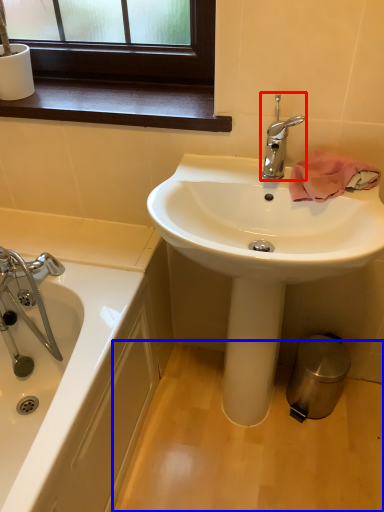
Question: Which object appears farthest to the camera in this image, tap (highlighted by a red box) or plain (highlighted by a blue box)?

Choices:
 (A) tap
 (B) plain

Answer: (B)